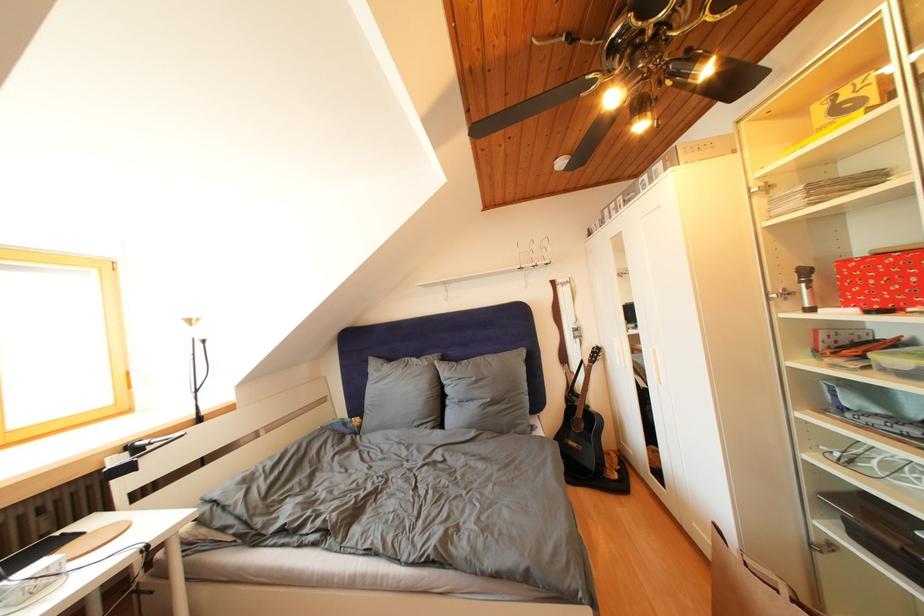
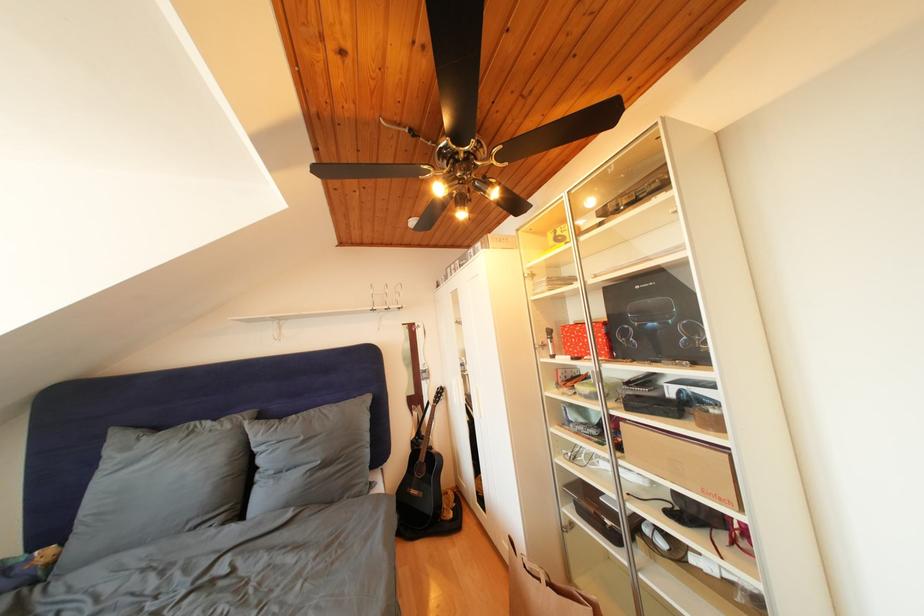
Locate, in the second image, the point that corresponds to (849,285) in the first image.

(572, 342)